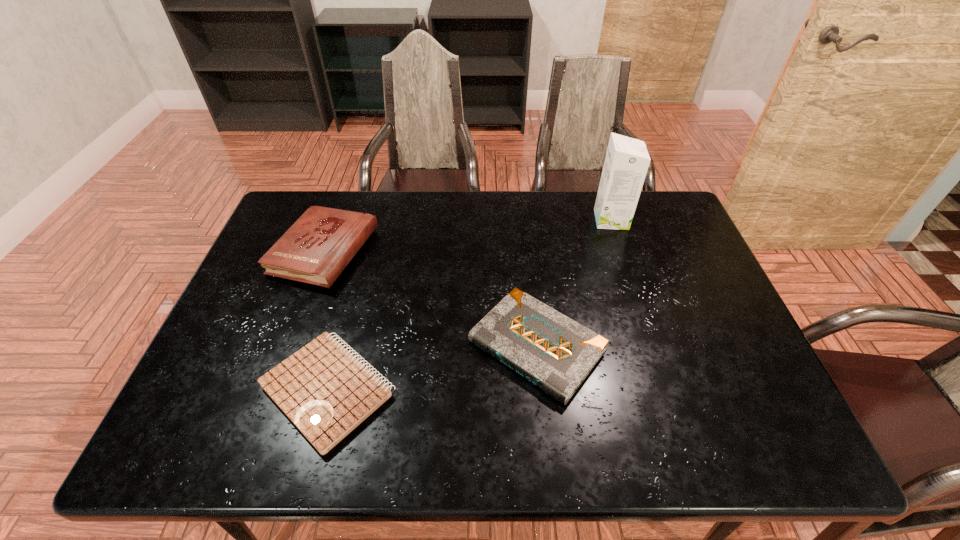
Where is `vacant space in between the hardback book and the shortest object`? The image size is (960, 540). vacant space in between the hardback book and the shortest object is located at coordinates (326, 321).

Where is `empty space between the carton and the hardback book`? This screenshot has width=960, height=540. empty space between the carton and the hardback book is located at coordinates pyautogui.click(x=468, y=235).

The width and height of the screenshot is (960, 540). I want to click on empty space that is in between the hardback book and the tallest object, so click(468, 235).

Find the location of a particular element. The image size is (960, 540). vacant space in between the right notebook and the left notebook is located at coordinates (432, 368).

This screenshot has width=960, height=540. Find the location of `free space between the taller notebook and the third shortest object`. free space between the taller notebook and the third shortest object is located at coordinates (431, 299).

You are a GUI agent. You are given a task and a screenshot of the screen. Output one action in this format:
    pyautogui.click(x=<x>, y=<y>)
    Task: Click on the object that ranks as the closest to the hardback book
    The width and height of the screenshot is (960, 540).
    Given the screenshot: What is the action you would take?
    pyautogui.click(x=324, y=390)

Locate which object ranks in proximity to the third shortest object. Please provide its 2D coordinates. Your answer should be formatted as a tuple, i.e. [(x, y)], where the tuple contains the x and y coordinates of a point satisfying the conditions above.

[(324, 390)]

Where is `free location that satisfies the following two spatial constraints: 1. on the back side of the rightmost object; 2. on the right side of the left notebook`? free location that satisfies the following two spatial constraints: 1. on the back side of the rightmost object; 2. on the right side of the left notebook is located at coordinates (373, 220).

What are the coordinates of `vacant point that satisfies the following two spatial constraints: 1. on the back side of the shorter notebook; 2. on the right side of the taller notebook` in the screenshot? It's located at (340, 346).

I want to click on free space that satisfies the following two spatial constraints: 1. on the front side of the right notebook; 2. on the right side of the third shortest object, so click(x=291, y=346).